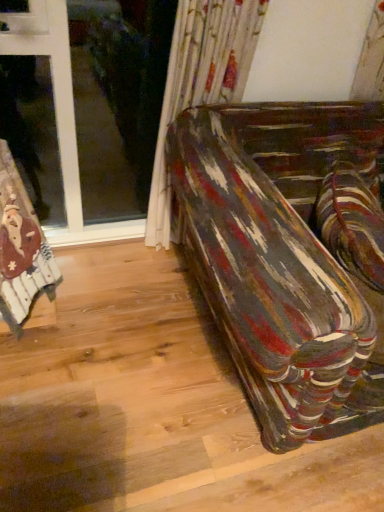
Locate an element on the screen. vacant space behind white fabric tablecloth at left is located at coordinates (77, 269).